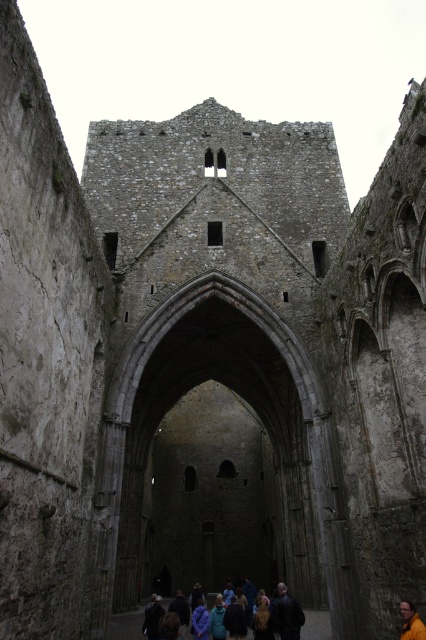
Does dark brown leather jacket at center have a greater height compared to yellow fabric person at center?

Correct, dark brown leather jacket at center is much taller as yellow fabric person at center.

Find the location of `dark brown leather jacket at center`. dark brown leather jacket at center is located at coordinates (287, 614).

You are a GUI agent. You are given a task and a screenshot of the screen. Output one action in this format:
    pyautogui.click(x=<x>, y=<y>)
    Task: Click on the dark brown leather jacket at center
    The width and height of the screenshot is (426, 640).
    Given the screenshot: What is the action you would take?
    pyautogui.click(x=287, y=614)

Is dark blue jacket at lower center in front of dark brown leather jacket at center?

That is False.

Who is more distant from viewer, (298, 616) or (288, 637)?

The point (298, 616) is behind.

Between point (293, 637) and point (285, 637), which one is positioned in front?

Point (285, 637) is in front.

You are a GUI agent. You are given a task and a screenshot of the screen. Output one action in this format:
    pyautogui.click(x=<x>, y=<y>)
    Task: Click on the dark blue jacket at lower center
    The width and height of the screenshot is (426, 640).
    Given the screenshot: What is the action you would take?
    pyautogui.click(x=180, y=608)

Which of these two, dark blue jacket at lower center or yellow fabric person at center, stands shorter?

yellow fabric person at center is shorter.

Is dark blue jacket at lower center to the left of yellow fabric person at center from the viewer's perspective?

Indeed, dark blue jacket at lower center is positioned on the left side of yellow fabric person at center.

You are a GUI agent. You are given a task and a screenshot of the screen. Output one action in this format:
    pyautogui.click(x=<x>, y=<y>)
    Task: Click on the dark blue jacket at lower center
    Image resolution: width=426 pixels, height=640 pixels.
    Given the screenshot: What is the action you would take?
    pyautogui.click(x=180, y=608)